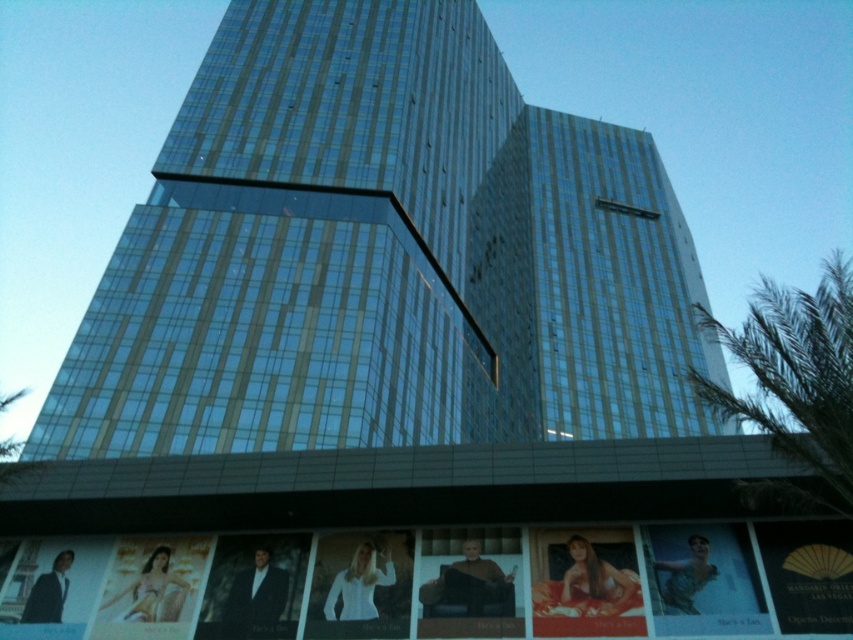
Is point (757, 584) positioned in front of point (94, 541)?

Yes, point (757, 584) is closer to viewer.

This screenshot has width=853, height=640. I want to click on matte blue dress at lower right, so click(703, 579).

The width and height of the screenshot is (853, 640). Describe the element at coordinates (703, 579) in the screenshot. I see `matte blue dress at lower right` at that location.

Where is `matte blue dress at lower right`? The height and width of the screenshot is (640, 853). matte blue dress at lower right is located at coordinates click(703, 579).

Who is positioned more to the left, glassy metallic building at center or white glossy poster at lower center?

Positioned to the left is white glossy poster at lower center.

Measure the distance between point (451, 316) and camera.

Point (451, 316) is 72.04 meters away from camera.

Find the location of a particular element. The height and width of the screenshot is (640, 853). glassy metallic building at center is located at coordinates (383, 257).

Identify the location of glassy metallic building at center. (383, 257).

Is glassy metallic building at center to the left of matte gold poster at lower left from the viewer's perspective?

No, glassy metallic building at center is not to the left of matte gold poster at lower left.

Who is taller, glassy metallic building at center or matte gold poster at lower left?

With more height is glassy metallic building at center.

Between point (299, 292) and point (132, 616), which one is positioned behind?

The point (299, 292) is more distant.

At what (x,y) coordinates should I click in order to perform the action: click on glassy metallic building at center. Please return your answer as a coordinate pair (x, y). This screenshot has width=853, height=640. Looking at the image, I should click on (383, 257).